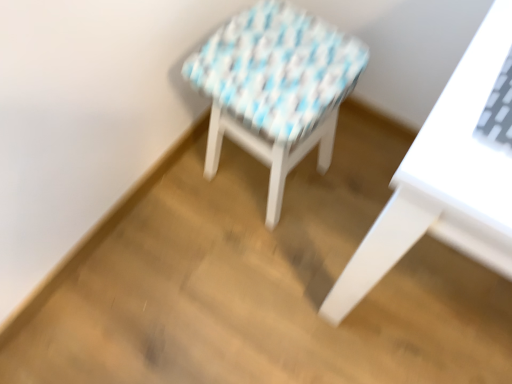
What are the coordinates of `free area in between white glossy table at right and white woven stool at center` in the screenshot? It's located at (313, 220).